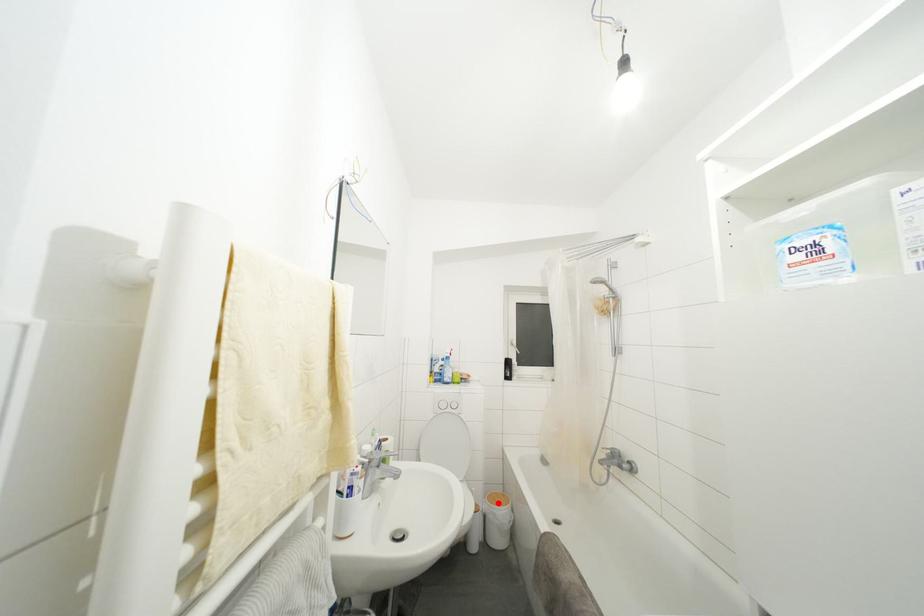
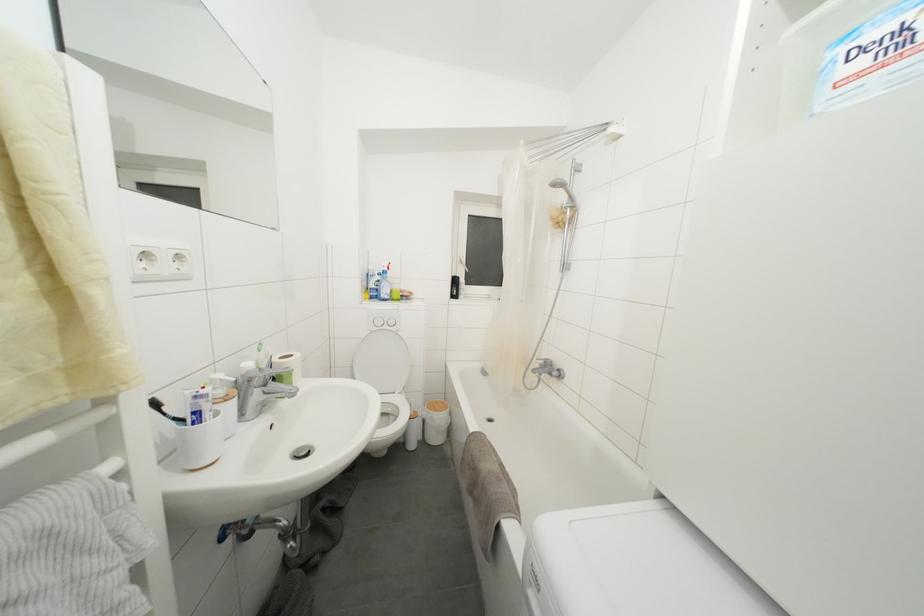
The point at the highlighted location is marked in the first image. Where is the corresponding point in the second image?

(438, 411)